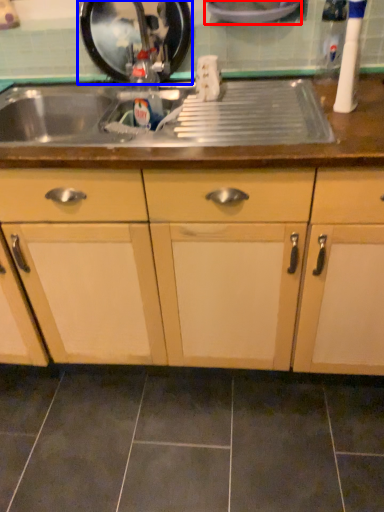
Question: Which object is further to the camera taking this photo, appliance (highlighted by a red box) or appliance (highlighted by a blue box)?

Choices:
 (A) appliance
 (B) appliance

Answer: (B)